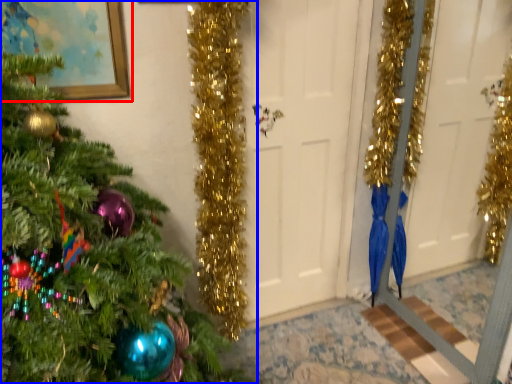
Question: Which point is further to the camera, picture frame (highlighted by a red box) or christmas tree (highlighted by a blue box)?

Choices:
 (A) picture frame
 (B) christmas tree

Answer: (A)